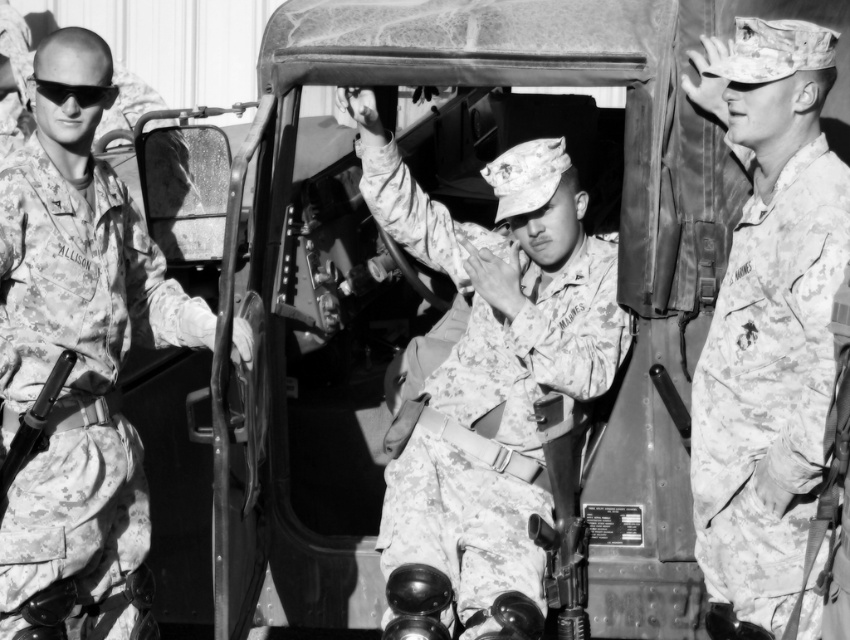
Question: Does camouflage uniform at center appear on the left side of camouflage uniform at right?

Choices:
 (A) yes
 (B) no

Answer: (A)

Question: Which point is closer to the camera taking this photo?

Choices:
 (A) (604, 384)
 (B) (85, 563)
 (C) (697, 104)

Answer: (C)

Question: Among these objects, which one is farthest from the camera?

Choices:
 (A) camouflage uniform at left
 (B) camouflage uniform at center
 (C) camouflage uniform at right

Answer: (B)

Question: Among these objects, which one is nearest to the camera?

Choices:
 (A) camouflage uniform at left
 (B) camouflage uniform at center
 (C) camouflage uniform at right

Answer: (C)

Question: Does camouflage uniform at center appear over camouflage uniform at left?

Choices:
 (A) no
 (B) yes

Answer: (A)

Question: Where is camouflage uniform at center located in relation to camouflage uniform at left in the image?

Choices:
 (A) below
 (B) above

Answer: (A)